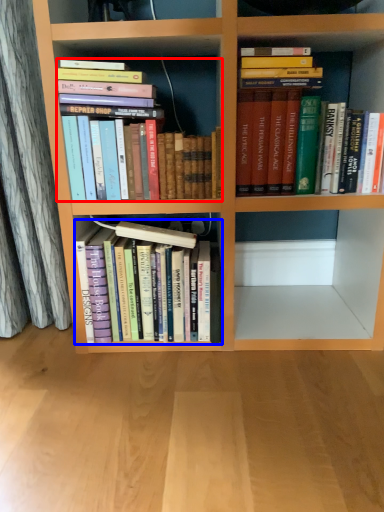
Question: Among these objects, which one is farthest to the camera, book (highlighted by a red box) or book (highlighted by a blue box)?

Choices:
 (A) book
 (B) book

Answer: (B)